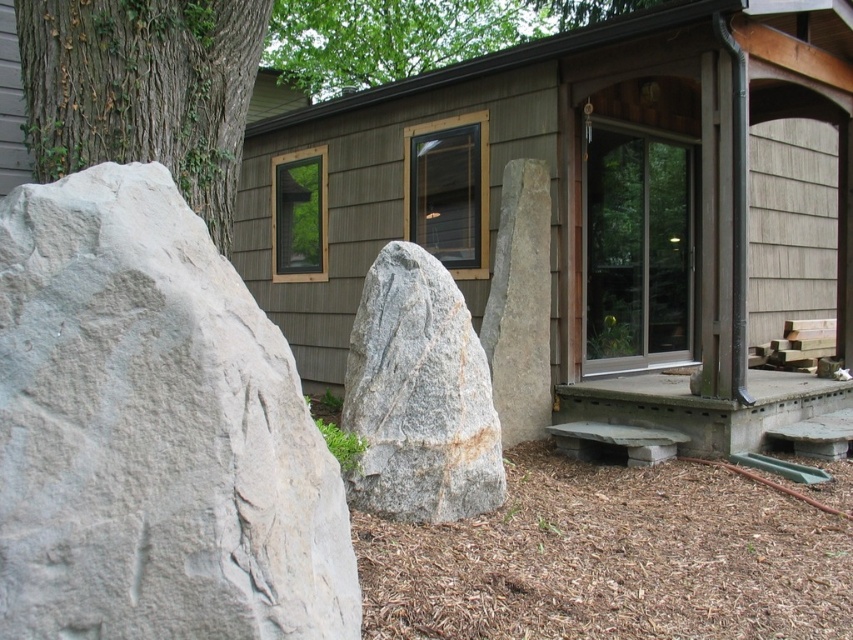
You are planning to build a new shed and want to ensure it fits between the wooden cabin at center and the green rough bark tree at left. Given that the shed requires a space wider than the narrower of the two structures, will the available space between them accommodate the shed?

The wooden cabin at center is thinner than the green rough bark tree at left, so the narrower structure is the wooden cabin at center. Since the shed requires space wider than the narrower structure, the available space between them may not be sufficient unless the shed is smaller than the cabin.